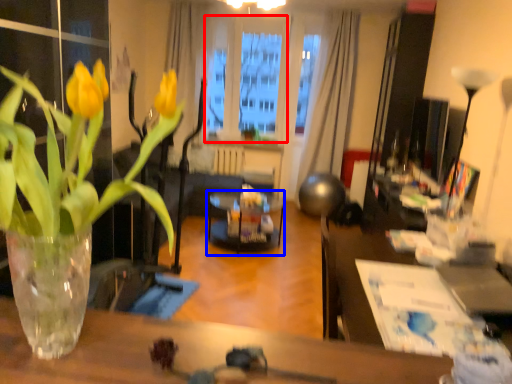
Question: Which of the following is the closest to the observer, window screen (highlighted by a red box) or glass table (highlighted by a blue box)?

Choices:
 (A) window screen
 (B) glass table

Answer: (B)